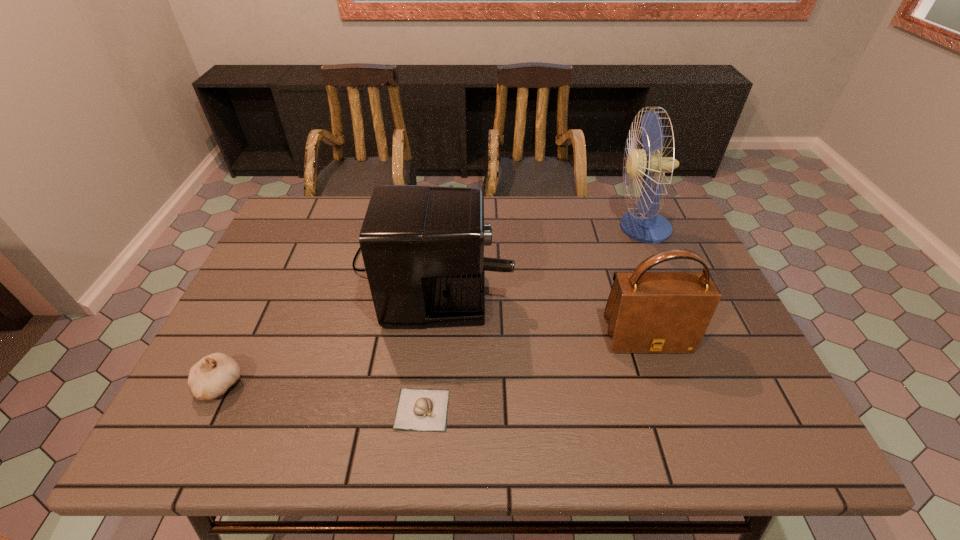
This screenshot has width=960, height=540. I want to click on vacant region located on the front-facing side of the coffee maker, so click(x=611, y=260).

At what (x,y) coordinates should I click in order to perform the action: click on vacant space located 0.090m on the front flap of the shoulder bag. Please return your answer as a coordinate pair (x, y). Looking at the image, I should click on (664, 390).

Locate an element on the screen. This screenshot has height=540, width=960. vacant space located 0.340m on the right of the leftmost object is located at coordinates (399, 385).

Locate an element on the screen. free space located 0.120m on the right of the right garlic is located at coordinates (506, 409).

Where is `fan positioned at the far edge`? This screenshot has height=540, width=960. fan positioned at the far edge is located at coordinates (x=644, y=225).

This screenshot has height=540, width=960. I want to click on coffee maker at the far edge, so click(x=423, y=246).

This screenshot has width=960, height=540. Find the location of `object that is positioned at the near edge`. object that is positioned at the near edge is located at coordinates (418, 409).

You are a GUI agent. You are given a task and a screenshot of the screen. Output one action in this format:
    pyautogui.click(x=<x>, y=<y>)
    Task: Click on the object present at the left edge
    This screenshot has height=540, width=960.
    Given the screenshot: What is the action you would take?
    pyautogui.click(x=213, y=375)

You are a GUI agent. You are given a task and a screenshot of the screen. Output one action in this format:
    pyautogui.click(x=<x>, y=<y>)
    Task: Click on the fan positioned at the right edge
    
    Given the screenshot: What is the action you would take?
    pyautogui.click(x=644, y=225)

At what (x,y) coordinates should I click in order to perform the action: click on shoulder bag at the right edge. Please return your answer as a coordinate pair (x, y). Image resolution: width=960 pixels, height=540 pixels. Looking at the image, I should click on (650, 312).